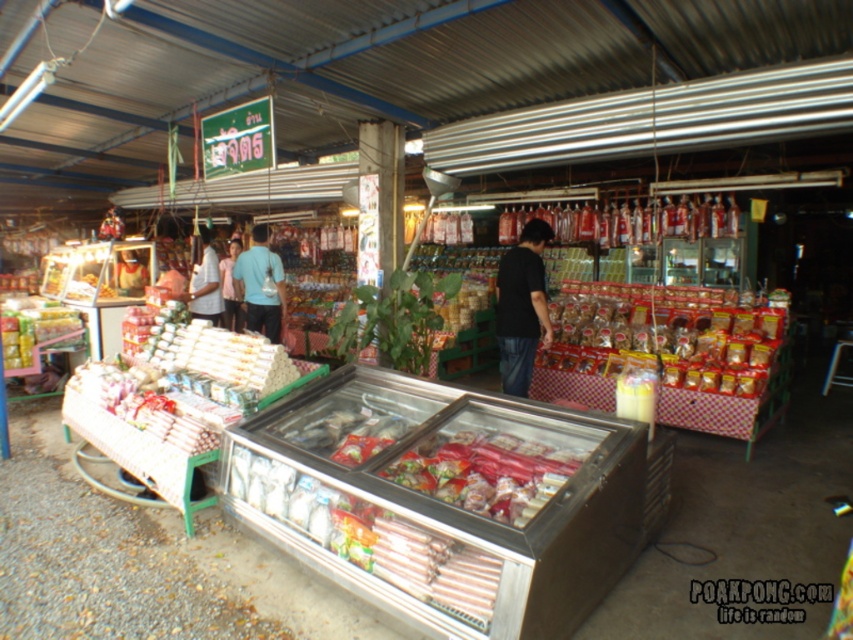
Between white paper rolls at left and white matte shirt at center, which one has more height?

white paper rolls at left

Does white paper rolls at left have a greater width compared to white matte shirt at center?

Yes, white paper rolls at left is wider than white matte shirt at center.

Does point (161, 349) come farther from viewer compared to point (215, 257)?

No.

Where is `white paper rolls at left`? Image resolution: width=853 pixels, height=640 pixels. white paper rolls at left is located at coordinates (190, 371).

Is white paper rolls at left further to camera compared to light blue shirt at center?

No.

Based on the photo, is white paper rolls at left closer to the viewer compared to light blue shirt at center?

Yes, white paper rolls at left is in front of light blue shirt at center.

Is point (282, 355) less distant than point (231, 316)?

Yes, point (282, 355) is closer to viewer.

I want to click on white paper rolls at left, so click(x=190, y=371).

In order to click on white paper rolls at left in this screenshot , I will do `click(190, 371)`.

Can you confirm if white paper rolls at left is thinner than black matte shirt at center?

No, white paper rolls at left is not thinner than black matte shirt at center.

Locate an element on the screen. white paper rolls at left is located at coordinates (190, 371).